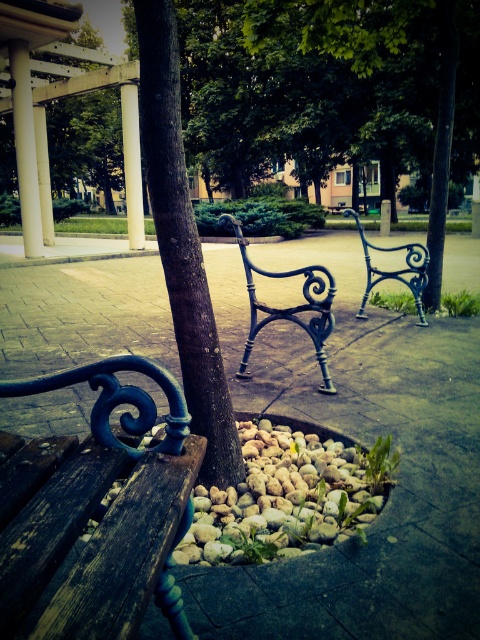
Does brown rough tree trunk at center have a greater width compared to black wrought iron bench at center?

In fact, brown rough tree trunk at center might be narrower than black wrought iron bench at center.

Between brown rough tree trunk at center and black wrought iron bench at center, which one appears on the left side from the viewer's perspective?

brown rough tree trunk at center is more to the left.

The image size is (480, 640). Describe the element at coordinates (182, 243) in the screenshot. I see `brown rough tree trunk at center` at that location.

Locate an element on the screen. brown rough tree trunk at center is located at coordinates (182, 243).

Can you confirm if black wrought iron bench at center is shorter than smooth white column at upper left?

Indeed, black wrought iron bench at center has a lesser height compared to smooth white column at upper left.

Consider the image. Which is above, black wrought iron bench at center or smooth white column at upper left?

Positioned higher is smooth white column at upper left.

Does point (249, 285) come behind point (29, 168)?

No, it is in front of (29, 168).

Locate an element on the screen. Image resolution: width=480 pixels, height=640 pixels. black wrought iron bench at center is located at coordinates (288, 307).

Consider the image. Is smooth white column at upper left taller than blue wrought iron bench at center?

Correct, smooth white column at upper left is much taller as blue wrought iron bench at center.

Which of these two, smooth white column at upper left or blue wrought iron bench at center, stands shorter?

Standing shorter between the two is blue wrought iron bench at center.

Between point (20, 122) and point (416, 260), which one is positioned behind?

The point (20, 122) is behind.

The height and width of the screenshot is (640, 480). Identify the location of smooth white column at upper left. (25, 148).